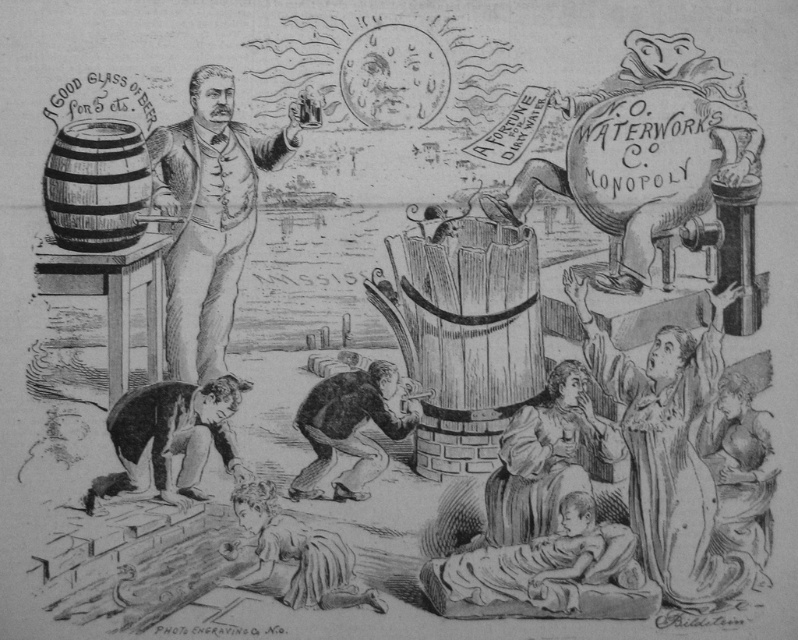
Question: Which is farther from the wooden barrel at left?

Choices:
 (A) etched wood portrait at center
 (B) smooth skin child at lower center
 (C) smooth skin person at lower left
 (D) dark brown leather boot at lower center

Answer: (B)

Question: Considering the relative positions of dark skin child at lower center and dark brown leather boot at lower center in the image provided, where is dark skin child at lower center located with respect to dark brown leather boot at lower center?

Choices:
 (A) below
 (B) above

Answer: (A)

Question: Which point is farther to the camera?

Choices:
 (A) (128, 416)
 (B) (74, 225)
 (C) (539, 570)

Answer: (B)

Question: Can you confirm if wooden barrel at left is positioned to the right of smooth skin child at lower center?

Choices:
 (A) no
 (B) yes

Answer: (A)

Question: Among these points, which one is farthest from the camera?

Choices:
 (A) (97, 186)
 (B) (178, 442)
 (C) (223, 83)

Answer: (A)

Question: Can you confirm if etched wood portrait at center is bigger than wooden barrel at left?

Choices:
 (A) yes
 (B) no

Answer: (A)